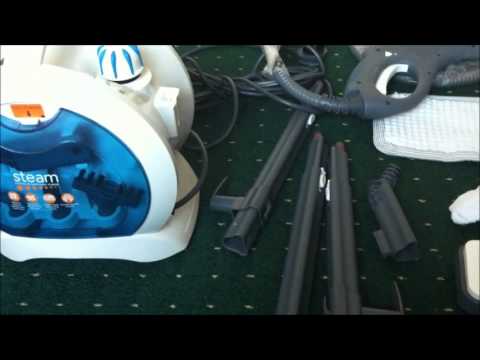
You are a GUI agent. You are given a task and a screenshot of the screen. Output one action in this format:
    pyautogui.click(x=<x>, y=<y>)
    Task: Click on the steam cleaner attachment
    This screenshot has height=360, width=480.
    Given the screenshot: What is the action you would take?
    pyautogui.click(x=248, y=225), pyautogui.click(x=300, y=247), pyautogui.click(x=343, y=248)